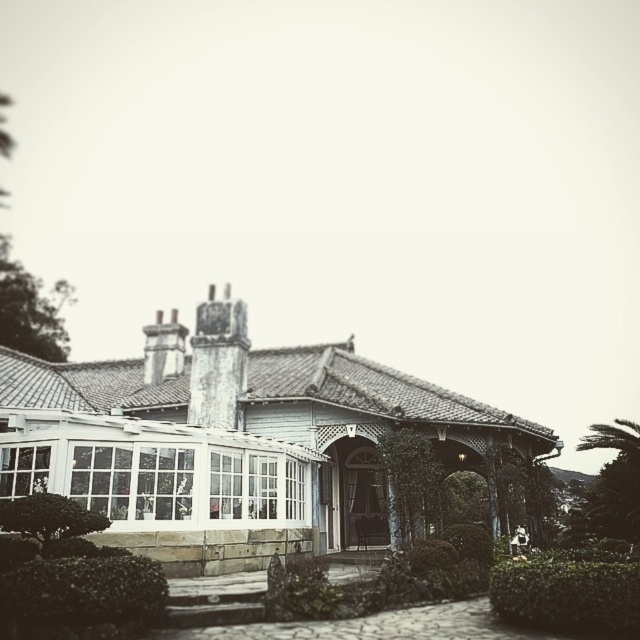
You are standing at the entrance of the house and want to walk to the green leafy hedge at lower left. Which direction should you move relative to the house?

The green leafy hedge at lower left is located at coordinate point 0.934 on the x axis and 0.128 on the y axis, so you should move towards the lower left direction relative to the house.

You are standing in the garden of the vintage house and want to enter the house through the main entrance. Which direction should you walk from the green leafy hedge at lower right to reach the white glass conservatory at center?

You should walk to the left from the green leafy hedge at lower right to reach the white glass conservatory at center, as the white glass conservatory at center is positioned to the left of the green leafy hedge at lower right.